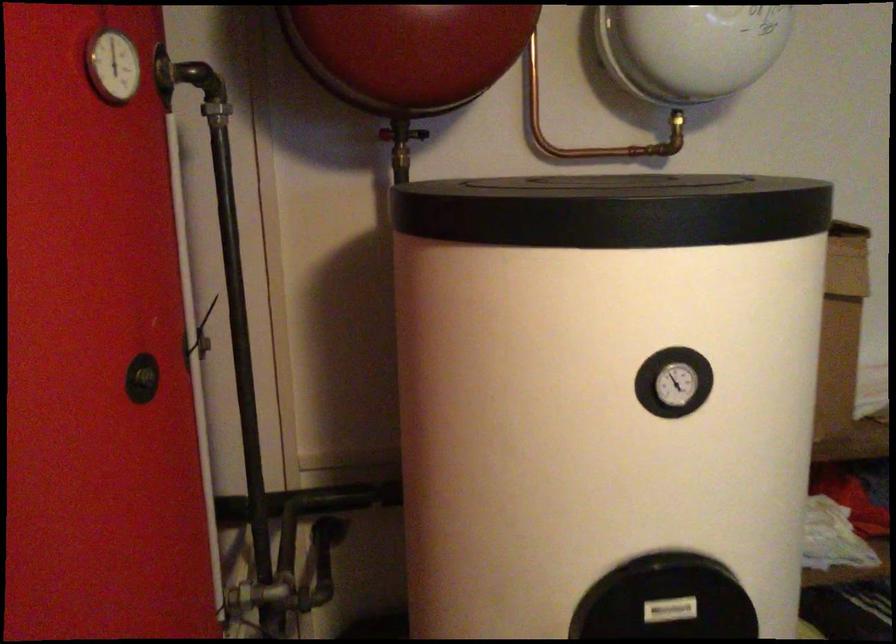
The image size is (896, 644). Identify the location of black door handle. (142, 379).